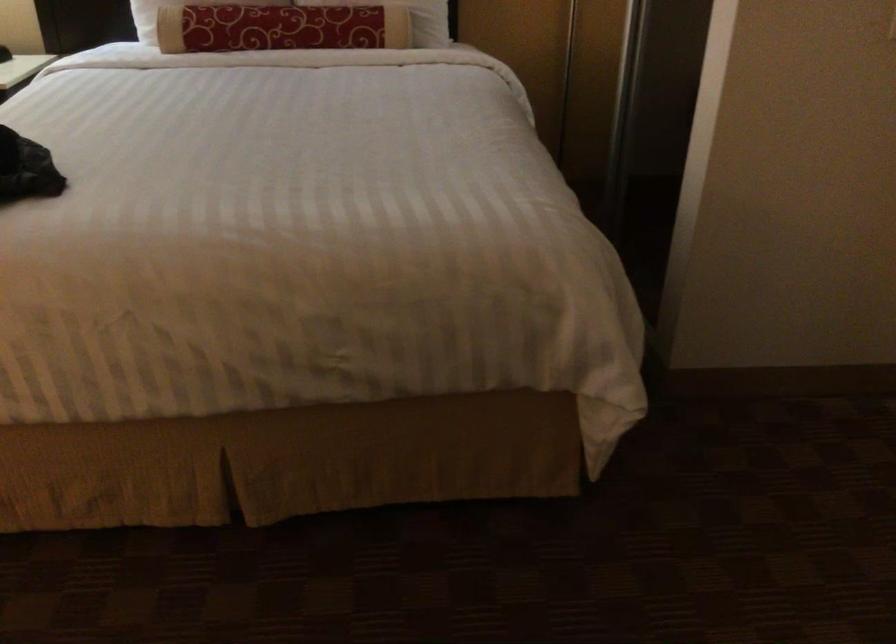
Where is `red patterned pillow`? Image resolution: width=896 pixels, height=644 pixels. red patterned pillow is located at coordinates (280, 28).